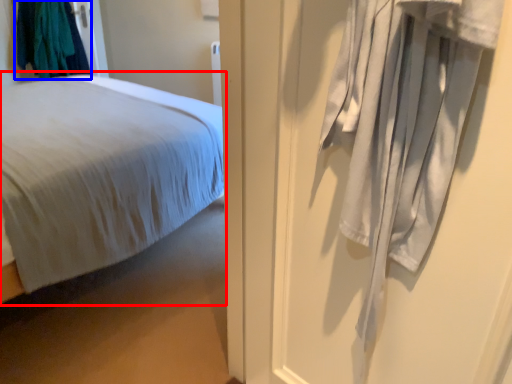
Question: Which object is further to the camera taking this photo, bed (highlighted by a red box) or clothing (highlighted by a blue box)?

Choices:
 (A) bed
 (B) clothing

Answer: (B)